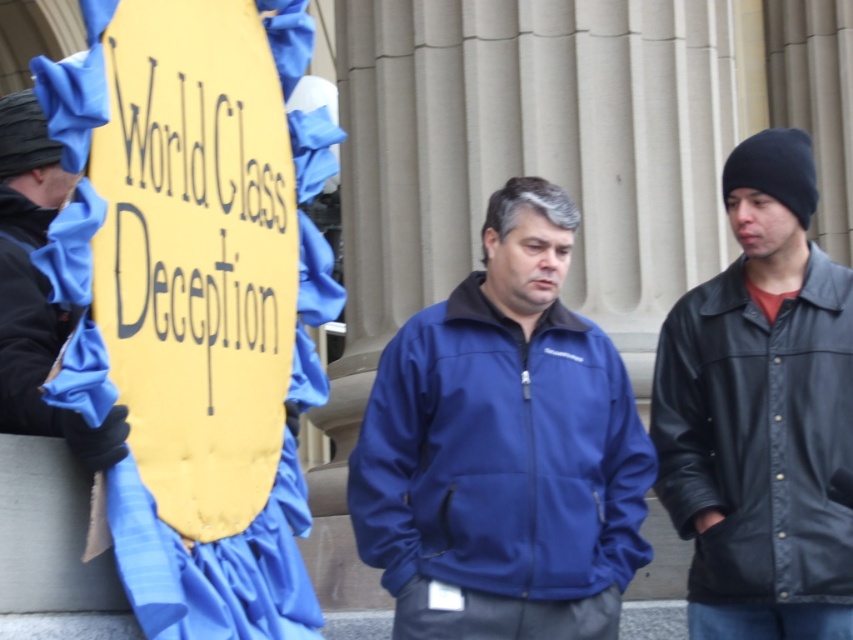
Can you confirm if matte blue jacket at center is thinner than black leather jacket at left?

Correct, matte blue jacket at center's width is less than black leather jacket at left's.

Can you confirm if matte blue jacket at center is positioned to the left of black leather jacket at left?

No, matte blue jacket at center is not to the left of black leather jacket at left.

Which is behind, point (465, 349) or point (35, 161)?

Positioned behind is point (465, 349).

You are a GUI agent. You are given a task and a screenshot of the screen. Output one action in this format:
    pyautogui.click(x=<x>, y=<y>)
    Task: Click on the matte blue jacket at center
    
    Given the screenshot: What is the action you would take?
    pyautogui.click(x=500, y=456)

Does black leather jacket at right lie behind black leather jacket at left?

Yes, it is behind black leather jacket at left.

Does black leather jacket at right have a greater height compared to black leather jacket at left?

Yes, black leather jacket at right is taller than black leather jacket at left.

Which is in front, point (770, 163) or point (27, 378)?

Point (27, 378) is in front.

Locate an element on the screen. The height and width of the screenshot is (640, 853). black leather jacket at right is located at coordinates (762, 413).

Does black leather jacket at left lie behind black matte jacket at left?

No, black leather jacket at left is closer to the viewer.

In the scene shown: Who is positioned more to the right, black leather jacket at left or black matte jacket at left?

Positioned to the right is black leather jacket at left.

Where is `black leather jacket at left`? The height and width of the screenshot is (640, 853). black leather jacket at left is located at coordinates (42, 365).